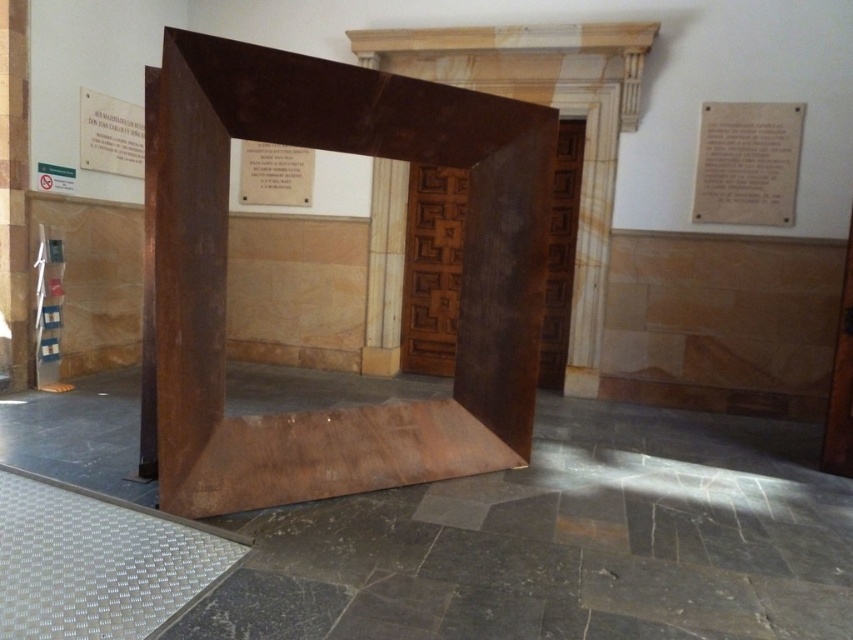
Question: From the image, what is the correct spatial relationship of rusty metal cube at center in relation to matte white plaque at upper right?

Choices:
 (A) below
 (B) above

Answer: (A)

Question: Is rusty metal cube at center wider than matte white plaque at upper right?

Choices:
 (A) no
 (B) yes

Answer: (B)

Question: Which of the following is the farthest from the observer?

Choices:
 (A) matte white plaque at upper right
 (B) rusty metal cube at center

Answer: (A)

Question: Can you confirm if rusty metal cube at center is thinner than matte white plaque at upper right?

Choices:
 (A) no
 (B) yes

Answer: (A)